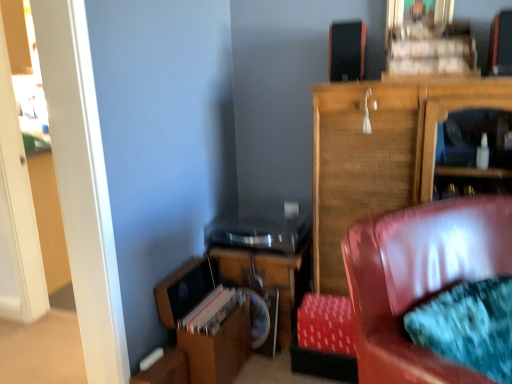
Question: Can you confirm if wooden table at lower center is positioned to the left of wooden cabinet at upper right?

Choices:
 (A) no
 (B) yes

Answer: (B)

Question: Does wooden table at lower center have a smaller size compared to wooden cabinet at upper right?

Choices:
 (A) yes
 (B) no

Answer: (A)

Question: From a real-world perspective, is wooden table at lower center over wooden cabinet at upper right?

Choices:
 (A) yes
 (B) no

Answer: (B)

Question: Does wooden table at lower center have a larger size compared to wooden cabinet at upper right?

Choices:
 (A) no
 (B) yes

Answer: (A)

Question: Is wooden table at lower center oriented away from wooden cabinet at upper right?

Choices:
 (A) yes
 (B) no

Answer: (B)

Question: From the image's perspective, relative to red fabric footrest at lower right, is wooden table at lower center above or below?

Choices:
 (A) above
 (B) below

Answer: (A)

Question: From their relative heights in the image, would you say wooden table at lower center is taller or shorter than red fabric footrest at lower right?

Choices:
 (A) short
 (B) tall

Answer: (B)

Question: Considering their positions, is wooden table at lower center located in front of or behind red fabric footrest at lower right?

Choices:
 (A) behind
 (B) front

Answer: (A)

Question: Considering the positions of point (264, 253) and point (337, 365), is point (264, 253) closer or farther from the camera than point (337, 365)?

Choices:
 (A) farther
 (B) closer

Answer: (A)

Question: Relative to wooden cabinet at upper right, is red fabric footrest at lower right in front or behind?

Choices:
 (A) front
 (B) behind

Answer: (B)

Question: Visually, is red fabric footrest at lower right positioned to the left or to the right of wooden cabinet at upper right?

Choices:
 (A) right
 (B) left

Answer: (B)

Question: From a real-world perspective, is red fabric footrest at lower right above or below wooden cabinet at upper right?

Choices:
 (A) above
 (B) below

Answer: (B)

Question: Which is correct: red fabric footrest at lower right is inside wooden cabinet at upper right, or outside of it?

Choices:
 (A) inside
 (B) outside

Answer: (B)

Question: From a real-world perspective, is wooden table at lower center positioned above or below black matte speaker at upper center?

Choices:
 (A) above
 (B) below

Answer: (B)

Question: From their relative heights in the image, would you say wooden table at lower center is taller or shorter than black matte speaker at upper center?

Choices:
 (A) tall
 (B) short

Answer: (A)